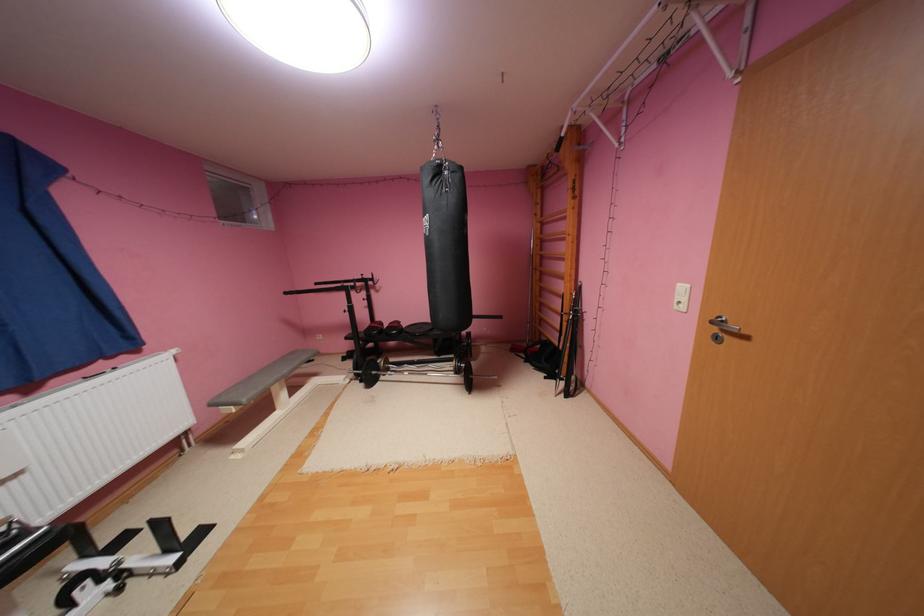
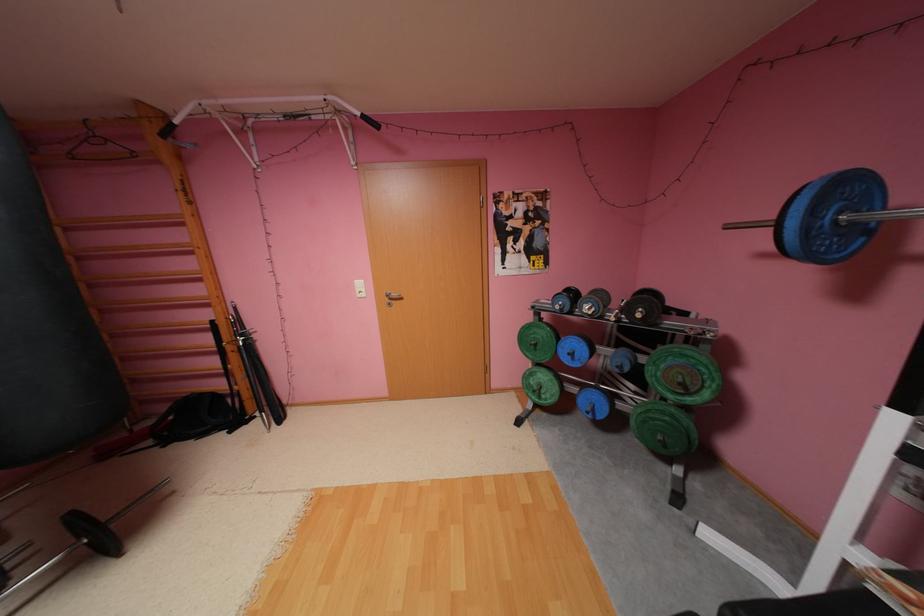
The point at (733, 330) is marked in the first image. Where is the corresponding point in the second image?

(399, 299)